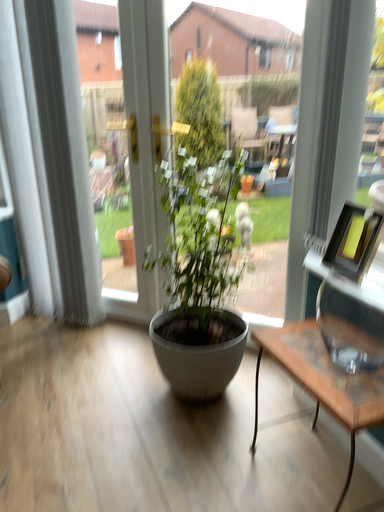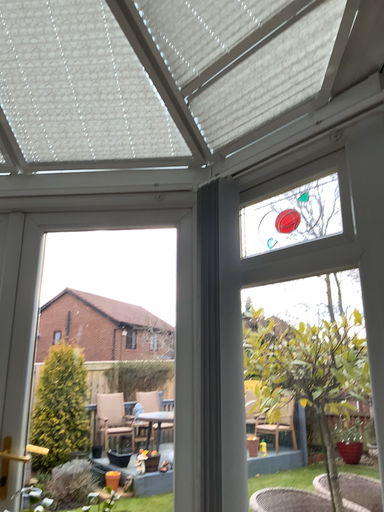
Question: How did the camera likely rotate when shooting the video?

Choices:
 (A) rotated left
 (B) rotated right

Answer: (B)